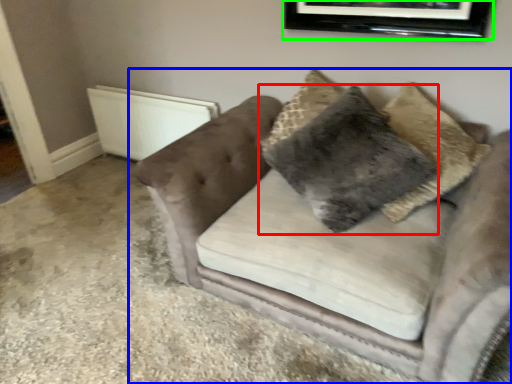
Question: Which is farther away from pillow (highlighted by a red box)? studio couch (highlighted by a blue box) or picture frame (highlighted by a green box)?

Choices:
 (A) studio couch
 (B) picture frame

Answer: (B)